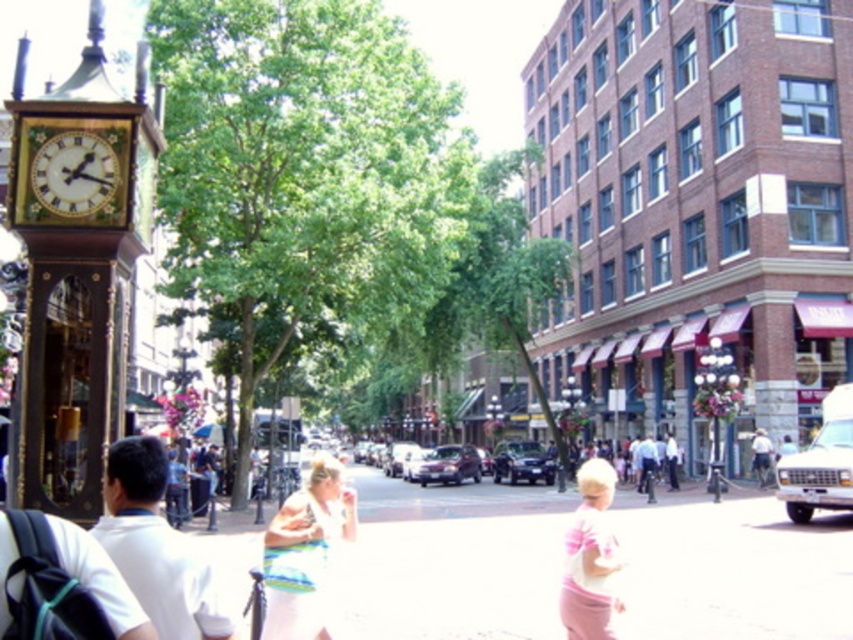
Question: Estimate the real-world distances between objects in this image. Which object is closer to the white cotton shirt at left?

Choices:
 (A) beige fabric bag at center
 (B) wooden clock at left

Answer: (B)

Question: Based on their relative distances, which object is nearer to the gold wooden clock at left?

Choices:
 (A) beige fabric bag at center
 (B) wooden clock at left
 (C) white cotton shirt at left
 (D) pink fabric at lower right

Answer: (B)

Question: Does white cotton shirt at left have a greater width compared to pink fabric at lower right?

Choices:
 (A) no
 (B) yes

Answer: (A)

Question: Can you confirm if pink fabric at lower right is wider than gold wooden clock at left?

Choices:
 (A) yes
 (B) no

Answer: (A)

Question: Is white cotton shirt at left wider than beige fabric bag at center?

Choices:
 (A) yes
 (B) no

Answer: (B)

Question: Among these objects, which one is nearest to the camera?

Choices:
 (A) gold wooden clock at left
 (B) beige fabric bag at center
 (C) pink fabric at lower right
 (D) wooden clock at left

Answer: (D)